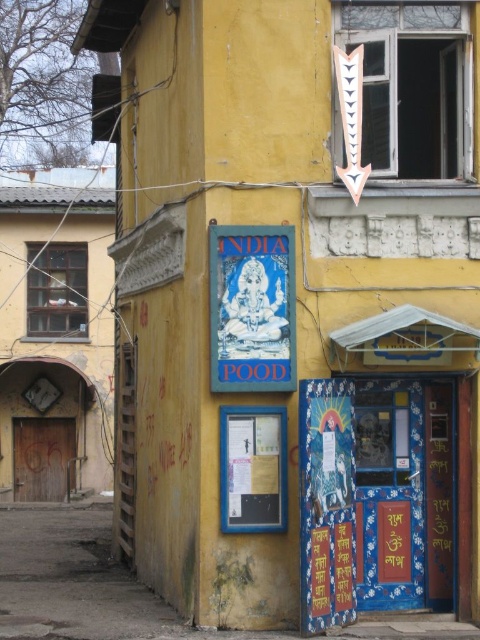
Question: Among these points, which one is farthest from the camera?

Choices:
 (A) pyautogui.click(x=108, y=426)
 (B) pyautogui.click(x=243, y=470)

Answer: (A)

Question: Can you confirm if wooden door at left is thinner than blue paper poster at center?

Choices:
 (A) yes
 (B) no

Answer: (B)

Question: Is wooden door at left wider than blue paper sign at center?

Choices:
 (A) no
 (B) yes

Answer: (A)

Question: Which point is farther from the camera taking this photo?

Choices:
 (A) (3, 262)
 (B) (240, 493)
 (C) (248, 378)

Answer: (A)

Question: Which object appears closest to the camera in this image?

Choices:
 (A) blue paper poster at center
 (B) wooden door at left

Answer: (A)

Question: Can you confirm if blue paper sign at center is positioned to the right of blue paper poster at center?

Choices:
 (A) no
 (B) yes

Answer: (A)